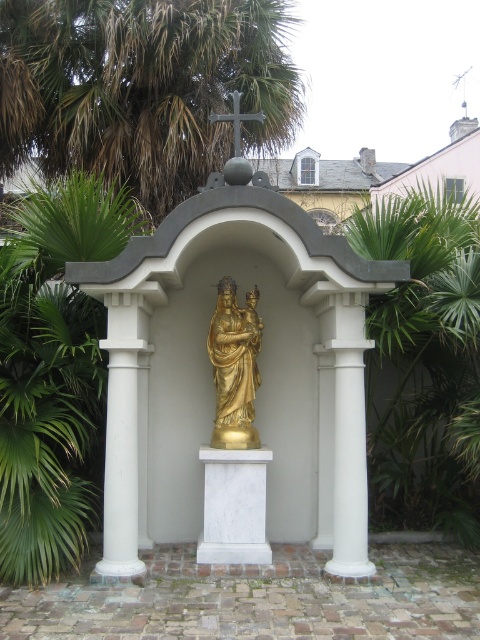
Question: Does white marble column at center appear under gold polished statue at center?

Choices:
 (A) no
 (B) yes

Answer: (B)

Question: Which of these objects is positioned closest to the green leafy palm tree at upper left?

Choices:
 (A) white marble pedestal at center
 (B) green leafy palm tree at center
 (C) white marble column at center
 (D) gold polished statue at center

Answer: (D)

Question: Considering the relative positions of white marble column at center and white marble pedestal at center in the image provided, where is white marble column at center located with respect to white marble pedestal at center?

Choices:
 (A) right
 (B) left

Answer: (B)

Question: Does green leafy palm tree at center appear under gold polished statue at center?

Choices:
 (A) no
 (B) yes

Answer: (B)

Question: Among these objects, which one is nearest to the camera?

Choices:
 (A) gold polished statue at center
 (B) green leafy palm tree at upper left
 (C) white marble pedestal at center
 (D) green leafy palm tree at center

Answer: (D)

Question: Considering the real-world distances, which object is closest to the green leafy palm tree at upper left?

Choices:
 (A) white marble pedestal at center
 (B) green leafy palm tree at center
 (C) white marble column at center

Answer: (B)